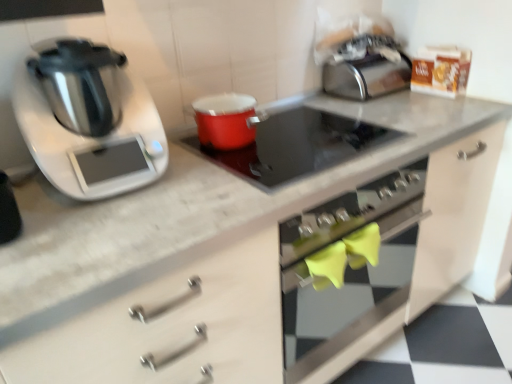
I want to click on vacant space to the right of shiny metallic pressure cooker at left, so click(198, 183).